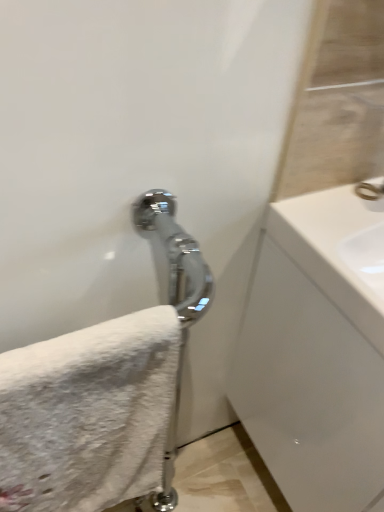
Question: Does white fluffy towel at lower left have a lesser height compared to polished chrome faucet at upper right?

Choices:
 (A) yes
 (B) no

Answer: (B)

Question: Can you confirm if white fluffy towel at lower left is thinner than polished chrome faucet at upper right?

Choices:
 (A) yes
 (B) no

Answer: (B)

Question: Is white fluffy towel at lower left to the left of polished chrome faucet at upper right from the viewer's perspective?

Choices:
 (A) yes
 (B) no

Answer: (A)

Question: From a real-world perspective, is white fluffy towel at lower left located beneath polished chrome faucet at upper right?

Choices:
 (A) yes
 (B) no

Answer: (A)

Question: Can you confirm if white fluffy towel at lower left is smaller than polished chrome faucet at upper right?

Choices:
 (A) no
 (B) yes

Answer: (A)

Question: Is white fluffy towel at lower left located outside polished chrome faucet at upper right?

Choices:
 (A) no
 (B) yes

Answer: (B)

Question: Does polished chrome faucet at upper right come behind white fluffy towel at lower left?

Choices:
 (A) yes
 (B) no

Answer: (A)

Question: Is polished chrome faucet at upper right next to white fluffy towel at lower left?

Choices:
 (A) no
 (B) yes

Answer: (A)

Question: Considering the relative positions of polished chrome faucet at upper right and white fluffy towel at lower left in the image provided, is polished chrome faucet at upper right to the right of white fluffy towel at lower left from the viewer's perspective?

Choices:
 (A) yes
 (B) no

Answer: (A)

Question: Is polished chrome faucet at upper right bigger than white fluffy towel at lower left?

Choices:
 (A) yes
 (B) no

Answer: (B)

Question: Does polished chrome faucet at upper right have a lesser height compared to white fluffy towel at lower left?

Choices:
 (A) no
 (B) yes

Answer: (B)

Question: Is polished chrome faucet at upper right taller than white fluffy towel at lower left?

Choices:
 (A) yes
 (B) no

Answer: (B)

Question: Is polished chrome faucet at upper right aimed at white glossy sink at right?

Choices:
 (A) yes
 (B) no

Answer: (B)